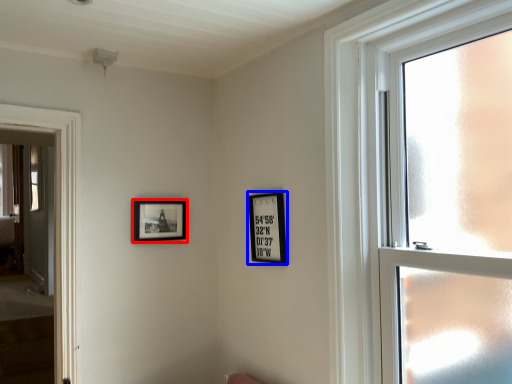
Question: Among these objects, which one is farthest to the camera, picture frame (highlighted by a red box) or picture frame (highlighted by a blue box)?

Choices:
 (A) picture frame
 (B) picture frame

Answer: (A)